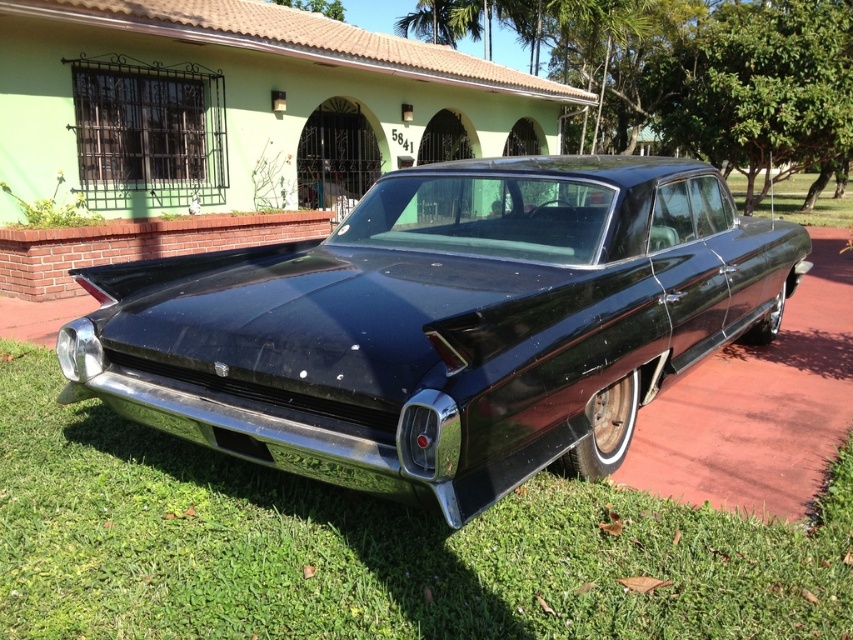
Which is above, glossy black car at center or green grass at lower center?

glossy black car at center

Is point (341, 248) less distant than point (113, 449)?

No, it is behind (113, 449).

Find the location of `glossy black car at center`. glossy black car at center is located at coordinates (444, 324).